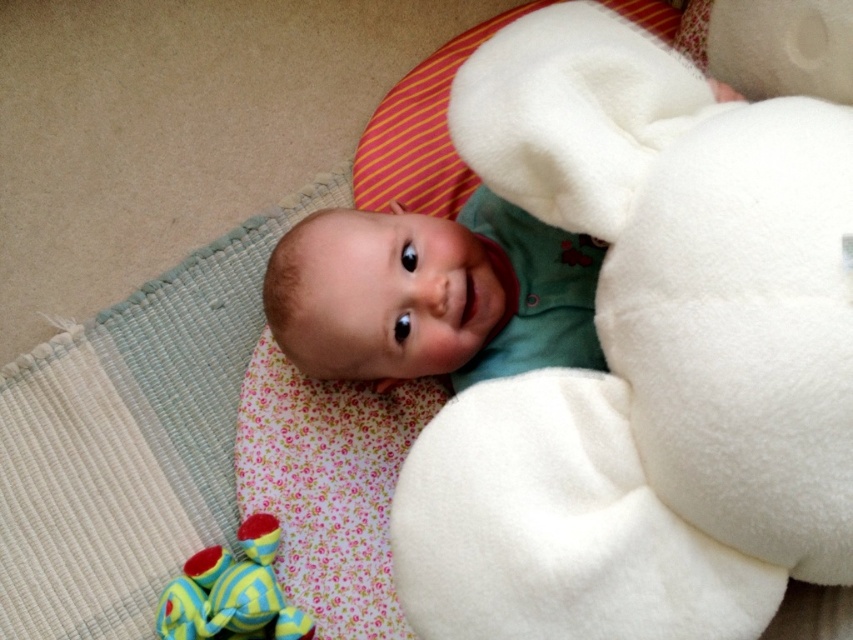
Describe the element at coordinates (433, 294) in the screenshot. I see `green fleece baby at center` at that location.

Can you confirm if green fleece baby at center is positioned above striped rubber toy at lower left?

Yes.

Is point (527, 353) positioned before point (180, 608)?

No.

Where is `green fleece baby at center`? green fleece baby at center is located at coordinates (433, 294).